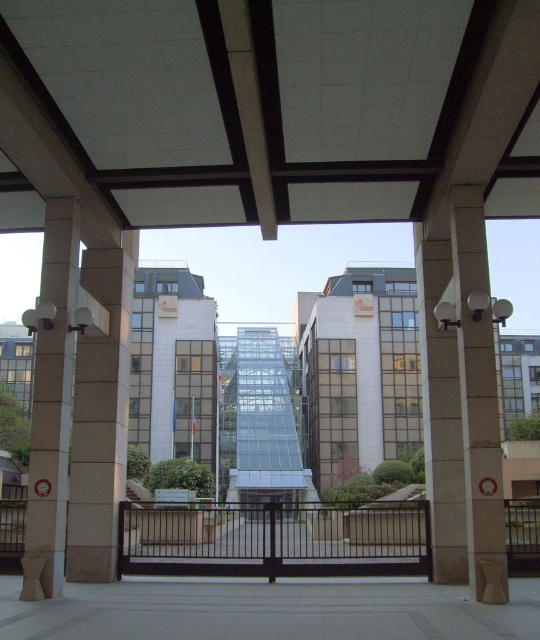
Question: Can you confirm if brown stone column at left is positioned to the right of slate gray concrete pillar at right?

Choices:
 (A) yes
 (B) no

Answer: (B)

Question: Does white tile ceiling at center have a lesser width compared to slate gray concrete pillar at right?

Choices:
 (A) no
 (B) yes

Answer: (A)

Question: Is the position of sanded concrete pillar at right more distant than that of brown stone column at left?

Choices:
 (A) yes
 (B) no

Answer: (A)

Question: Estimate the real-world distances between objects in this image. Which object is farther from the white tile ceiling at center?

Choices:
 (A) brown stone column at left
 (B) sanded concrete pillar at right
 (C) slate gray concrete pillar at right

Answer: (A)

Question: Among these points, which one is farthest from the camera?

Choices:
 (A) (489, 209)
 (B) (51, 301)
 (C) (433, 310)

Answer: (A)

Question: Which of the following is the farthest from the observer?

Choices:
 (A) sanded concrete pillar at right
 (B) brown stone column at left
 (C) white tile ceiling at center

Answer: (A)